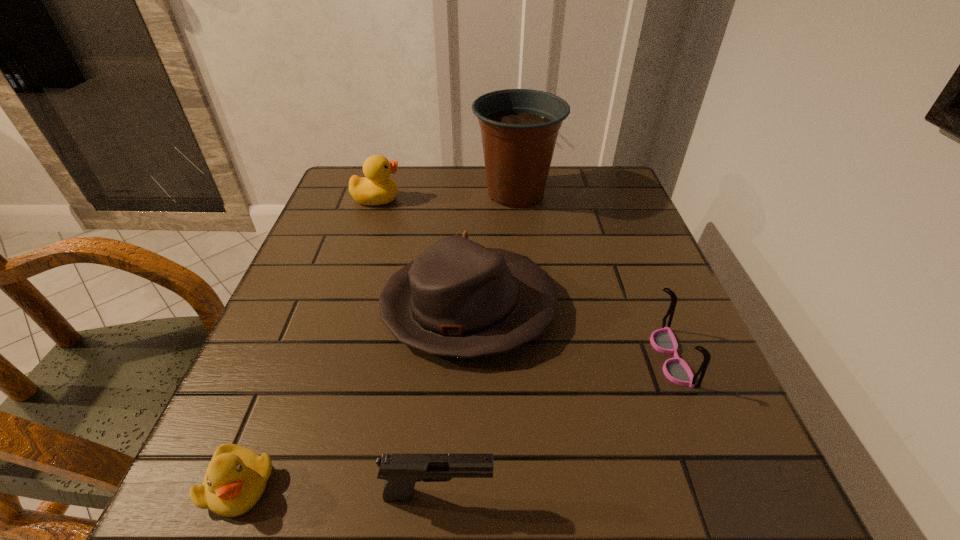
Find the location of a particular element. Image resolution: width=960 pixels, height=540 pixels. free spot between the duckling and the hat is located at coordinates (354, 396).

Where is `vacant area that lies between the rightmost object and the duckling`? This screenshot has height=540, width=960. vacant area that lies between the rightmost object and the duckling is located at coordinates (455, 421).

Where is `empty space that is in between the flowerpot and the shortest object`? This screenshot has width=960, height=540. empty space that is in between the flowerpot and the shortest object is located at coordinates (377, 339).

Where is `empty space that is in between the shortest object and the duck`? empty space that is in between the shortest object and the duck is located at coordinates (308, 342).

Choose which object is the nearest neighbor to the duck. Please provide its 2D coordinates. Your answer should be formatted as a tuple, i.e. [(x, y)], where the tuple contains the x and y coordinates of a point satisfying the conditions above.

[(519, 127)]

Choose which object is the third nearest neighbor to the duck. Please provide its 2D coordinates. Your answer should be formatted as a tuple, i.e. [(x, y)], where the tuple contains the x and y coordinates of a point satisfying the conditions above.

[(236, 477)]

The width and height of the screenshot is (960, 540). Identify the location of free space that satisfies the following two spatial constraints: 1. at the beak of the duck; 2. on the front-facing side of the duckling. (285, 485).

Find the location of a particular element. The image size is (960, 540). free spot that satisfies the following two spatial constraints: 1. at the beak of the rightmost object; 2. on the right side of the duck is located at coordinates (326, 356).

You are a GUI agent. You are given a task and a screenshot of the screen. Output one action in this format:
    pyautogui.click(x=<x>, y=<y>)
    Task: Click on the free space in the image that satisfies the following two spatial constraints: 1. on the front side of the flowerpot; 2. on the left side of the spectacles
    
    Given the screenshot: What is the action you would take?
    pyautogui.click(x=534, y=356)

This screenshot has height=540, width=960. What are the coordinates of `free spot that satisfies the following two spatial constraints: 1. at the beak of the duck; 2. on the back side of the spectacles` in the screenshot? It's located at [326, 356].